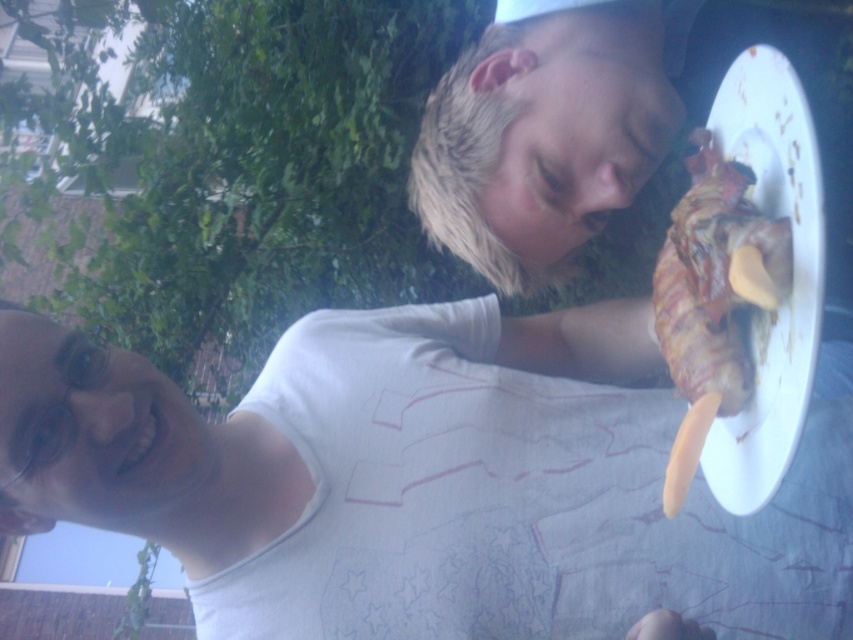
Question: Is the position of white matte shirt at center more distant than that of grilled meat with cheese at right?

Choices:
 (A) yes
 (B) no

Answer: (A)

Question: Is white matte plate at upper right smaller than grilled meat with cheese at right?

Choices:
 (A) yes
 (B) no

Answer: (B)

Question: Estimate the real-world distances between objects in this image. Which object is closer to the grilled meat with cheese at right?

Choices:
 (A) white matte shirt at center
 (B) white matte plate at upper right

Answer: (B)

Question: Which object is farther from the camera taking this photo?

Choices:
 (A) white matte shirt at center
 (B) grilled meat with cheese at right
 (C) white matte plate at upper right

Answer: (A)

Question: Which of the following is the farthest from the observer?

Choices:
 (A) (662, 292)
 (B) (793, 88)
 (C) (149, 380)

Answer: (A)

Question: Does white matte shirt at center have a larger size compared to white matte plate at upper right?

Choices:
 (A) no
 (B) yes

Answer: (B)